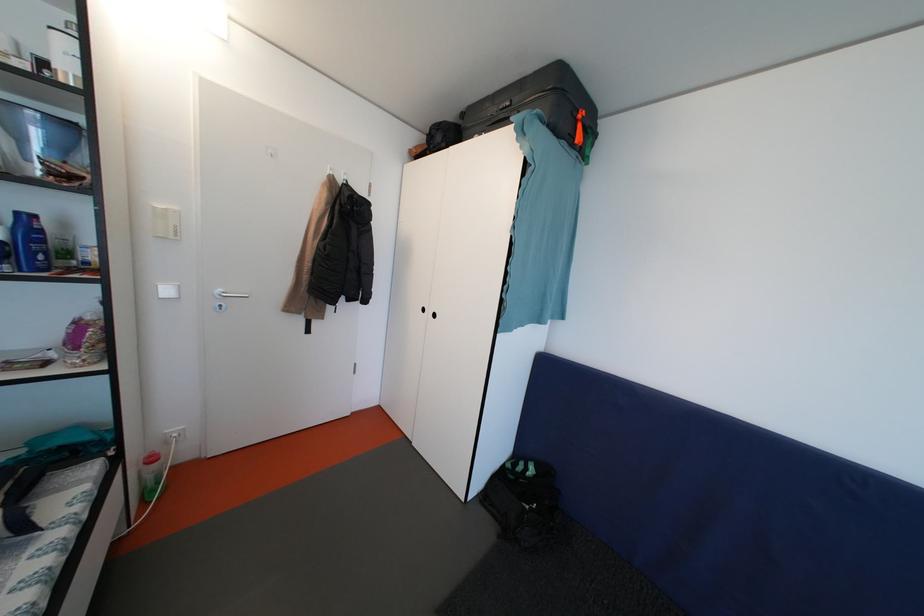
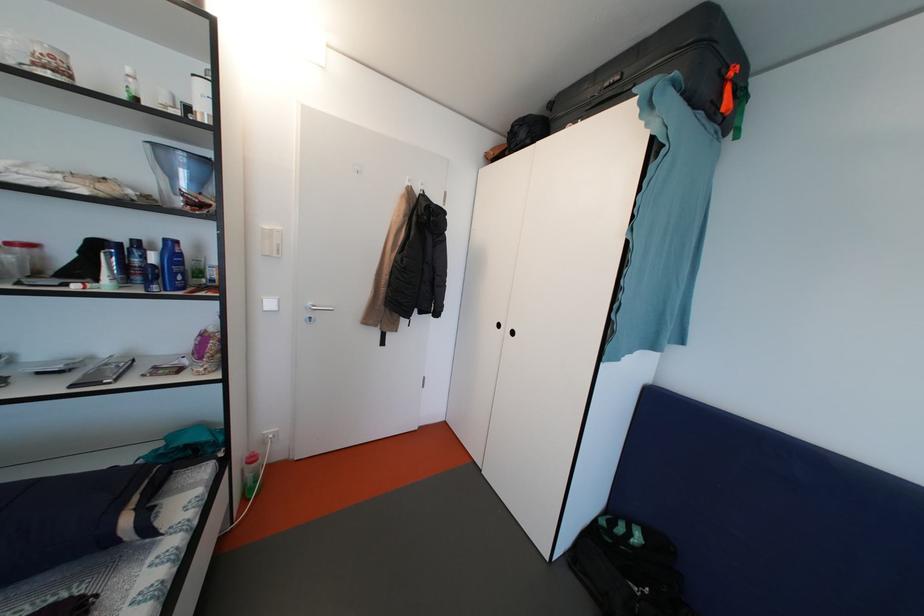
Question: The camera is either moving clockwise (left) or counter-clockwise (right) around the object. The first image is from the beginning of the video and the second image is from the end. Is the camera moving left or right when shooting the video?

Choices:
 (A) Left
 (B) Right

Answer: (B)